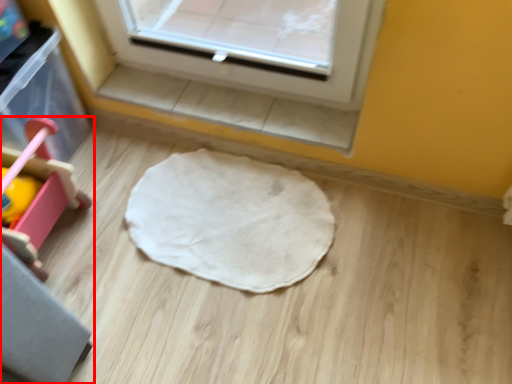
Question: Where is furniture (annotated by the red box) located in relation to mat in the image?

Choices:
 (A) left
 (B) right

Answer: (A)